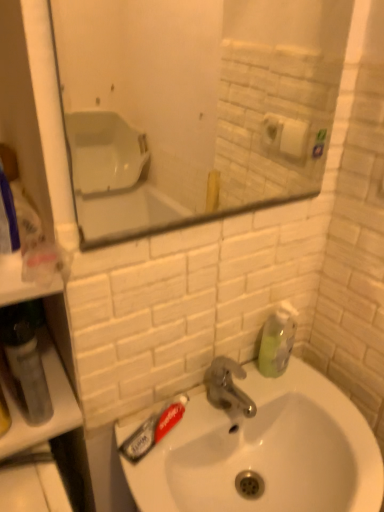
Question: From a real-world perspective, is translucent plastic toothpaste at sink left above or below matte glass mirror at upper center?

Choices:
 (A) below
 (B) above

Answer: (A)

Question: In the image, is translucent plastic toothpaste at sink left positioned in front of or behind matte glass mirror at upper center?

Choices:
 (A) front
 (B) behind

Answer: (B)

Question: Which is nearer to the translucent plastic mouthwash at left?

Choices:
 (A) matte glass mirror at upper center
 (B) white glossy sink at center
 (C) green translucent soap dispenser at right
 (D) translucent plastic toothpaste at sink left

Answer: (D)

Question: Which is nearer to the translucent plastic mouthwash at left?

Choices:
 (A) green translucent soap dispenser at right
 (B) translucent plastic toothpaste at sink left
 (C) matte glass mirror at upper center
 (D) white glossy sink at center

Answer: (B)